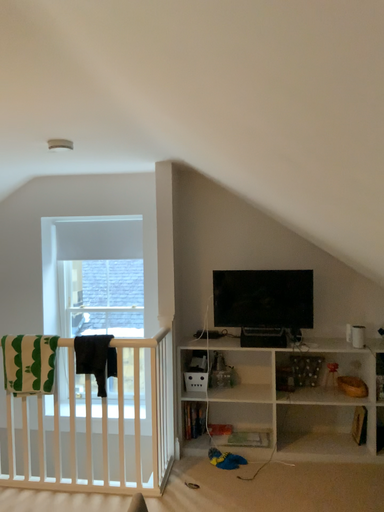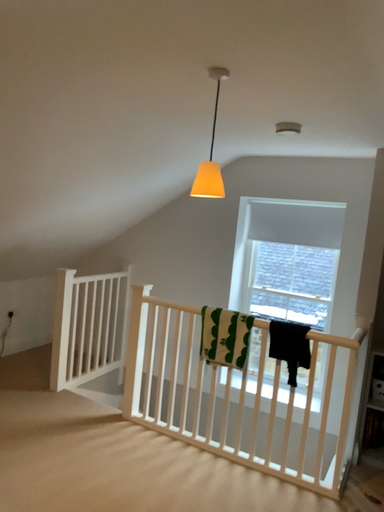
Question: How did the camera likely rotate when shooting the video?

Choices:
 (A) rotated right
 (B) rotated left

Answer: (B)